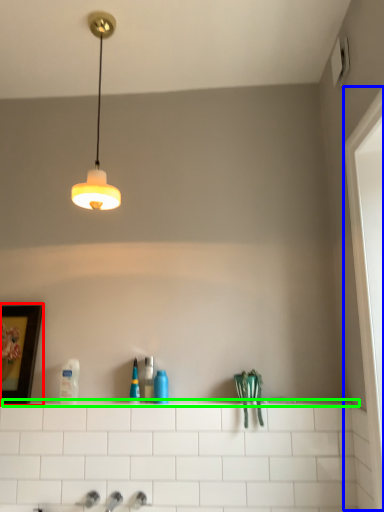
Question: Which object is the closest to the picture frame (highlighted by a red box)? Choose among these: screen door (highlighted by a blue box) or ledge (highlighted by a green box).

Choices:
 (A) screen door
 (B) ledge

Answer: (B)